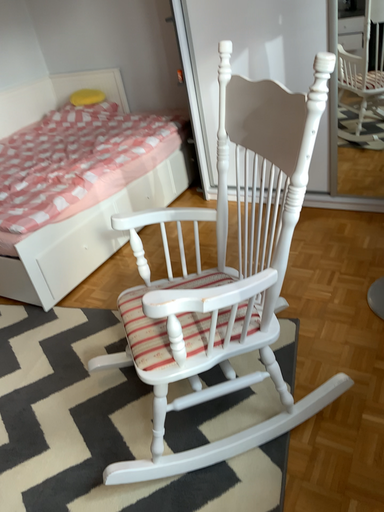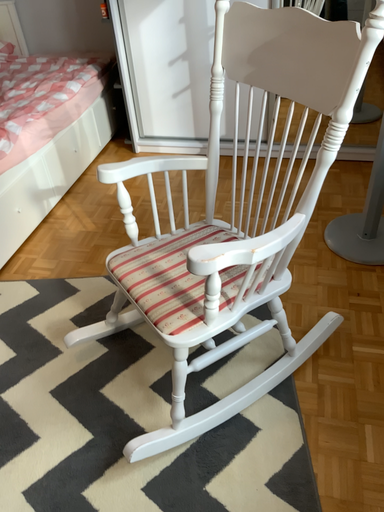
Question: How did the camera likely rotate when shooting the video?

Choices:
 (A) rotated right
 (B) rotated left

Answer: (A)